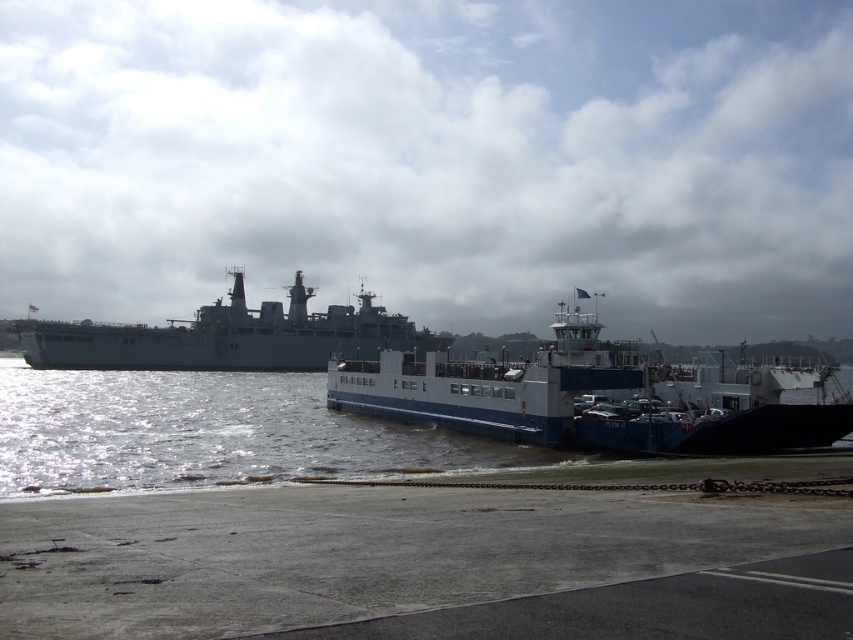
Question: Does glistening water at lower left appear over blue matte ferry at center?

Choices:
 (A) no
 (B) yes

Answer: (A)

Question: Based on their relative distances, which object is nearer to the gray matte ship at center?

Choices:
 (A) blue matte ferry at center
 (B) glistening water at lower left

Answer: (B)

Question: Estimate the real-world distances between objects in this image. Which object is closer to the blue matte ferry at center?

Choices:
 (A) glistening water at lower left
 (B) gray matte ship at center

Answer: (A)

Question: Is glistening water at lower left positioned before blue matte ferry at center?

Choices:
 (A) yes
 (B) no

Answer: (A)

Question: Which point is farther to the camera?

Choices:
 (A) (61, 344)
 (B) (844, 408)
 (C) (199, 452)

Answer: (A)

Question: Is glistening water at lower left wider than blue matte ferry at center?

Choices:
 (A) yes
 (B) no

Answer: (A)